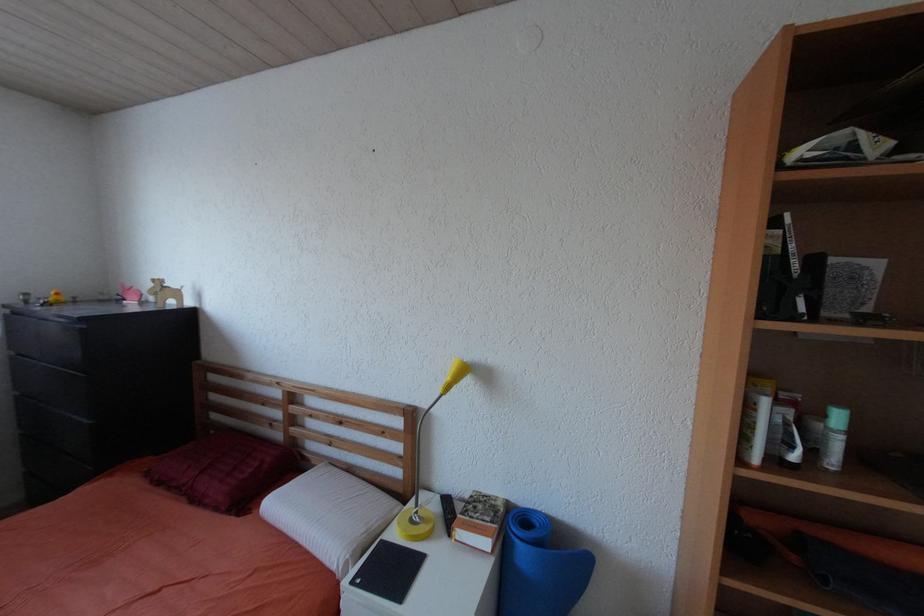
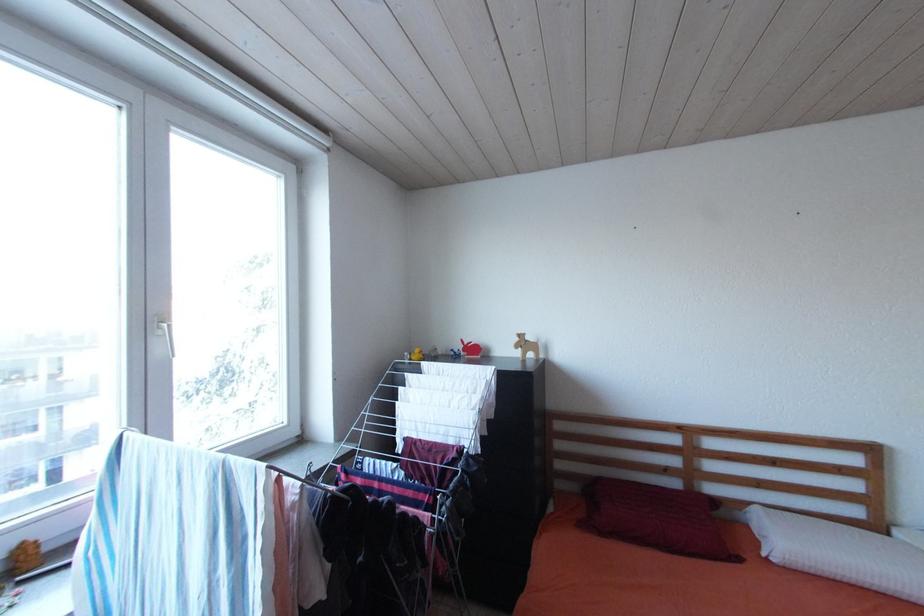
Question: What movement of the cameraman would produce the second image?

Choices:
 (A) Left
 (B) Right
 (C) Forward
 (D) Backward

Answer: (A)